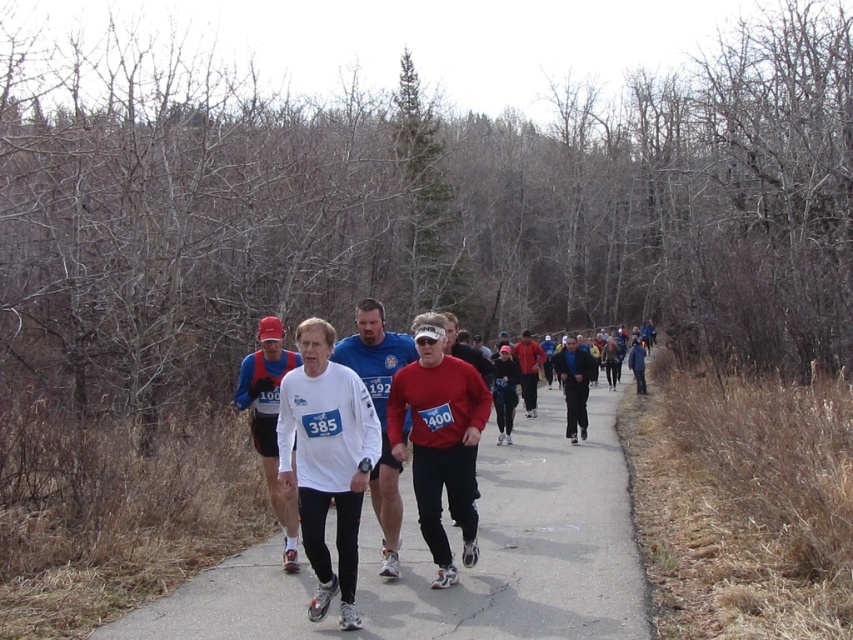
What is the location of the point labeled as point (456, 557) in the image?

The point labeled as point (456, 557) is on the gray asphalt road at center.